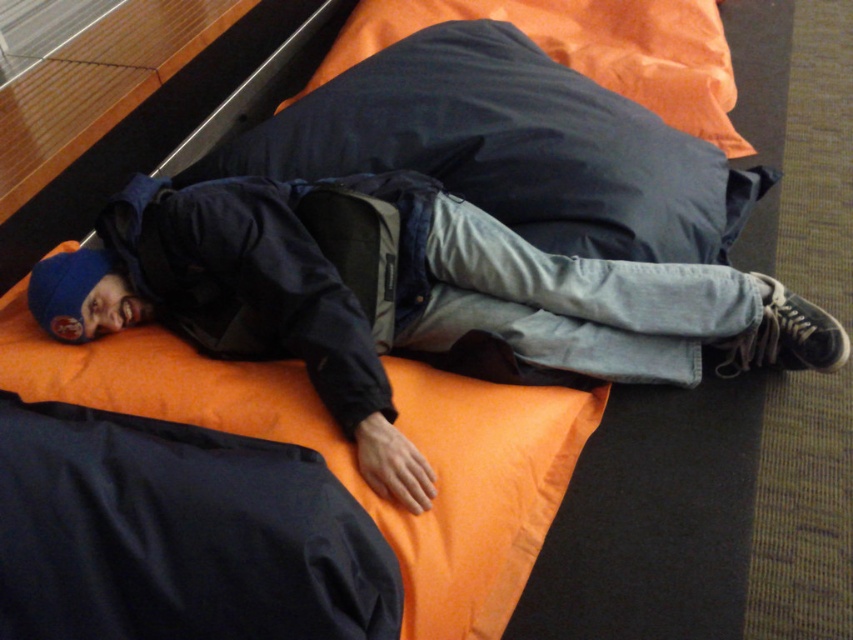
Question: Among these objects, which one is nearest to the camera?

Choices:
 (A) dark blue fabric pillow at upper center
 (B) dark blue matte jacket at center

Answer: (B)

Question: Is dark blue matte jacket at center to the right of dark blue fabric pillow at upper center from the viewer's perspective?

Choices:
 (A) yes
 (B) no

Answer: (B)

Question: Can you confirm if dark blue matte jacket at center is thinner than dark blue fabric pillow at upper center?

Choices:
 (A) no
 (B) yes

Answer: (B)

Question: Which of the following is the farthest from the observer?

Choices:
 (A) (285, 193)
 (B) (483, 8)

Answer: (B)

Question: Can you confirm if dark blue matte jacket at center is smaller than dark blue fabric pillow at upper center?

Choices:
 (A) no
 (B) yes

Answer: (B)